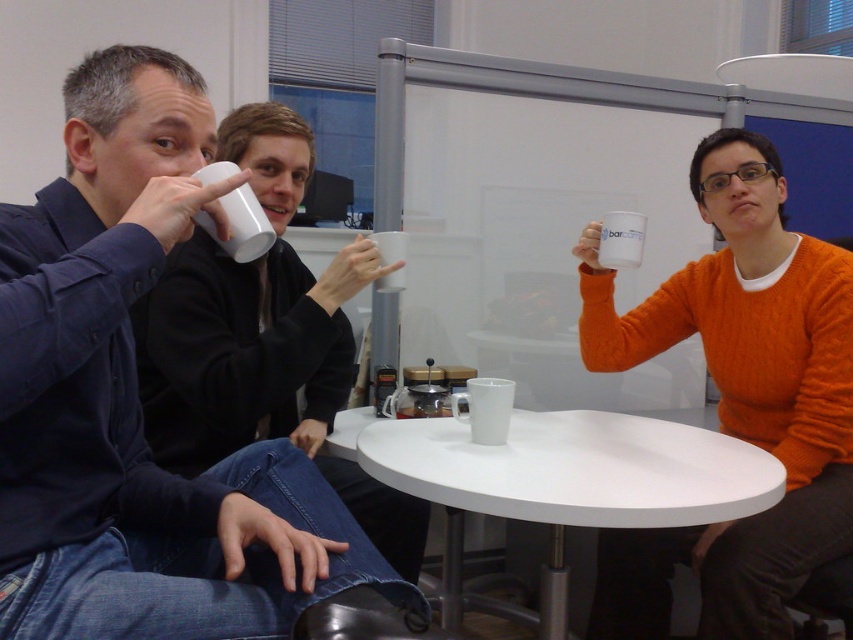
Question: Which is nearer to the white matte mug at center?

Choices:
 (A) orange knitted sweater at right
 (B) white matte mug at upper center
 (C) matte orange sweater at right

Answer: (C)

Question: Is white glossy table at center bigger than white matte mug at center?

Choices:
 (A) yes
 (B) no

Answer: (A)

Question: In this image, where is white glossy table at center located relative to white glossy mug at center?

Choices:
 (A) below
 (B) above

Answer: (A)

Question: Is white glossy mug at center smaller than white matte mug at upper right?

Choices:
 (A) no
 (B) yes

Answer: (A)

Question: Among these points, which one is farthest from the camera?

Choices:
 (A) (207, 349)
 (B) (717, 436)
 (C) (793, 268)

Answer: (C)

Question: Among these points, which one is nearest to the camera?

Choices:
 (A) (434, 419)
 (B) (231, 413)
 (C) (785, 369)
 (D) (639, 228)

Answer: (B)